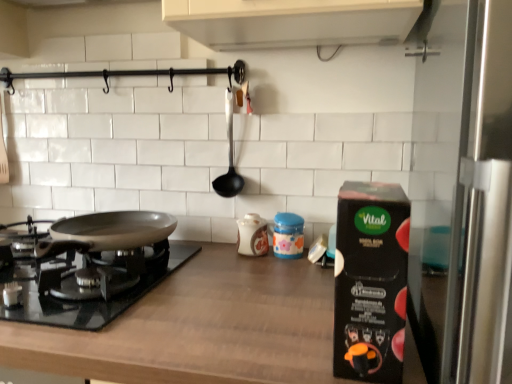
Measure the distance between brown wood countertop at center and camera.

The distance of brown wood countertop at center from camera is 56.58 centimeters.

What do you see at coordinates (200, 328) in the screenshot? The height and width of the screenshot is (384, 512). I see `brown wood countertop at center` at bounding box center [200, 328].

Looking at this image, measure the distance between point [5,272] and camera.

Point [5,272] and camera are 3.42 feet apart.

Locate an element on the screen. This screenshot has width=512, height=384. matte ceramic jar at center, arranged as the 3th kitchen appliance when viewed from the front is located at coordinates (252, 235).

Find the location of a particular element. The image size is (512, 384). black plastic ladle at center is located at coordinates (229, 158).

From the picture: Can you tell me how much matte ceramic jar at center, placed as the 3th kitchen appliance when sorted from right to left, and black cardboard box at right, the first kitchen appliance positioned from the right, differ in facing direction?

The angular difference between matte ceramic jar at center, placed as the 3th kitchen appliance when sorted from right to left, and black cardboard box at right, the first kitchen appliance positioned from the right, is 0.396 degrees.

Is matte ceramic jar at center, arranged as the 3th kitchen appliance when viewed from the front, wider or thinner than black cardboard box at right, which is counted as the 3th kitchen appliance, starting from the left?

matte ceramic jar at center, arranged as the 3th kitchen appliance when viewed from the front, is thinner than black cardboard box at right, which is counted as the 3th kitchen appliance, starting from the left.

In the scene shown: Is matte ceramic jar at center, the 1th kitchen appliance in the back-to-front sequence, oriented towards black cardboard box at right, the first kitchen appliance positioned from the right?

No, matte ceramic jar at center, the 1th kitchen appliance in the back-to-front sequence, is not aimed at black cardboard box at right, the first kitchen appliance positioned from the right.

Does matte ceramic jar at center, arranged as the 3th kitchen appliance when viewed from the front, have a smaller size compared to black cardboard box at right, acting as the 3th kitchen appliance starting from the back?

Indeed, matte ceramic jar at center, arranged as the 3th kitchen appliance when viewed from the front, has a smaller size compared to black cardboard box at right, acting as the 3th kitchen appliance starting from the back.

Where is `countertop that is under the matte ceramic jar at center, acting as the second kitchen appliance starting from the left (from a real-world perspective)`? countertop that is under the matte ceramic jar at center, acting as the second kitchen appliance starting from the left (from a real-world perspective) is located at coordinates (200, 328).

Is brown wood countertop at center completely or partially outside of matte ceramic jar at center, which is the second kitchen appliance in front-to-back order?

Yes, brown wood countertop at center is outside of matte ceramic jar at center, which is the second kitchen appliance in front-to-back order.

Could you tell me if brown wood countertop at center is facing matte ceramic jar at center, which is the second kitchen appliance in right-to-left order?

No, brown wood countertop at center is not turned towards matte ceramic jar at center, which is the second kitchen appliance in right-to-left order.

Which point is more distant from viewer, (143, 352) or (291, 215)?

The point (291, 215) is behind.

From the image's perspective, who appears lower, matte ceramic jar at center, the 1th kitchen appliance in the back-to-front sequence, or brown wood countertop at center?

From the image's view, brown wood countertop at center is below.

Can you confirm if matte ceramic jar at center, arranged as the 1th kitchen appliance when viewed from the left, is bigger than brown wood countertop at center?

Incorrect, matte ceramic jar at center, arranged as the 1th kitchen appliance when viewed from the left, is not larger than brown wood countertop at center.

Does matte ceramic jar at center, arranged as the 3th kitchen appliance when viewed from the front, turn towards brown wood countertop at center?

No, matte ceramic jar at center, arranged as the 3th kitchen appliance when viewed from the front, does not turn towards brown wood countertop at center.

From a real-world perspective, is matte ceramic jar at center, arranged as the 3th kitchen appliance when viewed from the front, under brown wood countertop at center?

Incorrect, from a real-world perspective, matte ceramic jar at center, arranged as the 3th kitchen appliance when viewed from the front, is higher than brown wood countertop at center.

I want to click on kitchen appliance on the right of matte ceramic jar at center, which is the second kitchen appliance in front-to-back order, so click(370, 281).

From a real-world perspective, is matte ceramic jar at center, which is the second kitchen appliance in right-to-left order, on top of black cardboard box at right, acting as the 3th kitchen appliance starting from the back?

No, from a real-world perspective, matte ceramic jar at center, which is the second kitchen appliance in right-to-left order, is not over black cardboard box at right, acting as the 3th kitchen appliance starting from the back

Is point (295, 229) behind point (389, 369)?

Yes, it is.

Does matte ceramic jar at center, which is the second kitchen appliance in right-to-left order, have a smaller size compared to black cardboard box at right, which is counted as the 3th kitchen appliance, starting from the left?

Yes, matte ceramic jar at center, which is the second kitchen appliance in right-to-left order, is smaller than black cardboard box at right, which is counted as the 3th kitchen appliance, starting from the left.

Consider the image. Between brown wood countertop at center and matte ceramic jar at center, arranged as the 3th kitchen appliance when viewed from the front, which one has larger size?

Bigger between the two is brown wood countertop at center.

Is matte ceramic jar at center, arranged as the 1th kitchen appliance when viewed from the left, surrounded by brown wood countertop at center?

No, matte ceramic jar at center, arranged as the 1th kitchen appliance when viewed from the left, is not inside brown wood countertop at center.

Looking at this image, from a real-world perspective, which object rests below the other?

brown wood countertop at center.

Is brown wood countertop at center positioned with its back to matte ceramic jar at center, the 1th kitchen appliance in the back-to-front sequence?

No, brown wood countertop at center's orientation is not away from matte ceramic jar at center, the 1th kitchen appliance in the back-to-front sequence.

From the image's perspective, between matte ceramic jar at center, acting as the second kitchen appliance starting from the left, and black plastic ladle at center, which one is located above?

black plastic ladle at center is shown above in the image.

From a real-world perspective, is matte ceramic jar at center, which is the second kitchen appliance in right-to-left order, on top of black plastic ladle at center?

Incorrect, from a real-world perspective, matte ceramic jar at center, which is the second kitchen appliance in right-to-left order, is lower than black plastic ladle at center.

Which is more to the right, matte ceramic jar at center, which is the second kitchen appliance in front-to-back order, or black plastic ladle at center?

matte ceramic jar at center, which is the second kitchen appliance in front-to-back order, is more to the right.

Which object is thinner, matte ceramic jar at center, which is the second kitchen appliance in front-to-back order, or black plastic ladle at center?

black plastic ladle at center.

How many degrees apart are the facing directions of black plastic ladle at center and brown wood countertop at center?

They differ by 0.742 degrees in their facing directions.

Identify the location of countertop on the left of black plastic ladle at center. (200, 328).

In terms of size, does black plastic ladle at center appear bigger or smaller than brown wood countertop at center?

Clearly, black plastic ladle at center is smaller in size than brown wood countertop at center.

Locate an element on the screen. The height and width of the screenshot is (384, 512). the 2nd kitchen appliance to the left when counting from the black cardboard box at right, which is counted as the 3th kitchen appliance, starting from the left is located at coordinates (252, 235).

At what (x,y) coordinates should I click in order to perform the action: click on the 2nd kitchen appliance to the right of the brown wood countertop at center, starting your count from the anchor. Please return your answer as a coordinate pair (x, y). Looking at the image, I should click on (288, 235).

Estimate the real-world distances between objects in this image. Which object is closer to black cardboard box at right, which is counted as the 3th kitchen appliance, starting from the left, black plastic ladle at center or matte ceramic jar at center, the 1th kitchen appliance in the back-to-front sequence?

matte ceramic jar at center, the 1th kitchen appliance in the back-to-front sequence, is positioned closer to the anchor black cardboard box at right, which is counted as the 3th kitchen appliance, starting from the left.

Based on their spatial positions, is matte ceramic jar at center, arranged as the 3th kitchen appliance when viewed from the front, or matte ceramic jar at center, the 2th kitchen appliance when ordered from back to front, further from brown wood countertop at center?

The object further to brown wood countertop at center is matte ceramic jar at center, arranged as the 3th kitchen appliance when viewed from the front.

Based on their spatial positions, is black plastic ladle at center or black cardboard box at right, acting as the 3th kitchen appliance starting from the back, further from matte ceramic jar at center, placed as the 3th kitchen appliance when sorted from right to left?

black cardboard box at right, acting as the 3th kitchen appliance starting from the back.

Based on their spatial positions, is matte ceramic jar at center, the 2th kitchen appliance when ordered from back to front, or black cardboard box at right, acting as the 3th kitchen appliance starting from the back, closer to matte ceramic jar at center, placed as the 3th kitchen appliance when sorted from right to left?

matte ceramic jar at center, the 2th kitchen appliance when ordered from back to front, is closer to matte ceramic jar at center, placed as the 3th kitchen appliance when sorted from right to left.

When comparing their distances from matte ceramic jar at center, placed as the 3th kitchen appliance when sorted from right to left, does matte ceramic jar at center, the 2th kitchen appliance when ordered from back to front, or black plastic ladle at center seem closer?

Among the two, matte ceramic jar at center, the 2th kitchen appliance when ordered from back to front, is located nearer to matte ceramic jar at center, placed as the 3th kitchen appliance when sorted from right to left.

Which object lies nearer to the anchor point black plastic ladle at center, silver metallic pan at lower left or matte ceramic jar at center, the 1th kitchen appliance in the back-to-front sequence?

Based on the image, matte ceramic jar at center, the 1th kitchen appliance in the back-to-front sequence, appears to be nearer to black plastic ladle at center.

When comparing their distances from black plastic ladle at center, does matte ceramic jar at center, acting as the second kitchen appliance starting from the left, or silver metallic pan at lower left seem further?

Based on the image, silver metallic pan at lower left appears to be further to black plastic ladle at center.

Looking at the image, which one is located further to silver metallic pan at lower left, matte ceramic jar at center, placed as the 3th kitchen appliance when sorted from right to left, or matte ceramic jar at center, which is the second kitchen appliance in right-to-left order?

matte ceramic jar at center, which is the second kitchen appliance in right-to-left order, is further to silver metallic pan at lower left.

The image size is (512, 384). I want to click on utensil located between black cardboard box at right, acting as the 3th kitchen appliance starting from the back, and matte ceramic jar at center, the 1th kitchen appliance in the back-to-front sequence, in the depth direction, so click(x=229, y=158).

I want to click on gas stove between brown wood countertop at center and matte ceramic jar at center, placed as the 3th kitchen appliance when sorted from right to left, along the z-axis, so click(93, 268).

Locate an element on the screen. This screenshot has width=512, height=384. kitchen appliance between silver metallic pan at lower left and matte ceramic jar at center, acting as the second kitchen appliance starting from the left is located at coordinates (252, 235).

You are a GUI agent. You are given a task and a screenshot of the screen. Output one action in this format:
    pyautogui.click(x=<x>, y=<y>)
    Task: Click on the kitchen appliance that lies between black plastic ladle at center and matte ceramic jar at center, which is the second kitchen appliance in right-to-left order, from top to bottom
    The image size is (512, 384).
    Given the screenshot: What is the action you would take?
    pyautogui.click(x=252, y=235)